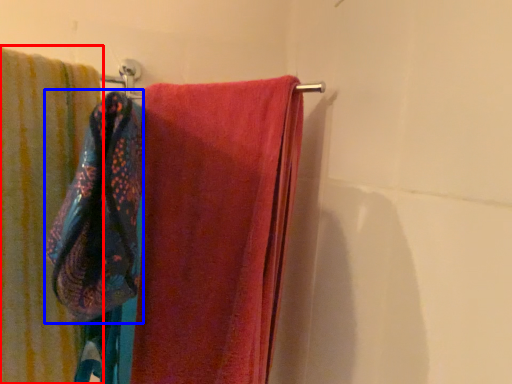
Question: Which point is closer to the camera, towel (highlighted by a red box) or beach towel (highlighted by a blue box)?

Choices:
 (A) towel
 (B) beach towel

Answer: (B)